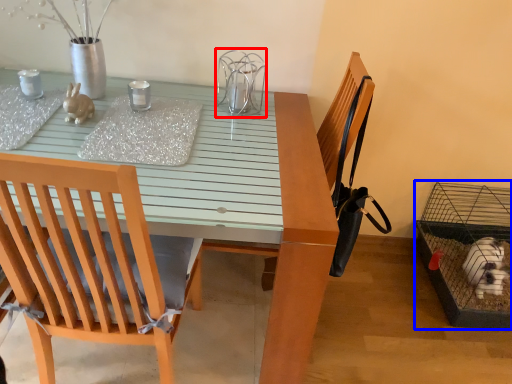
Question: Which point is further to the camera, bird cage (highlighted by a red box) or bird cage (highlighted by a blue box)?

Choices:
 (A) bird cage
 (B) bird cage

Answer: (B)